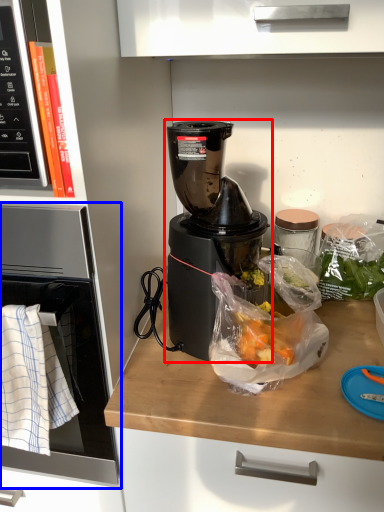
Question: Which point is further to the camera, blender (highlighted by a red box) or oven (highlighted by a blue box)?

Choices:
 (A) blender
 (B) oven

Answer: (A)